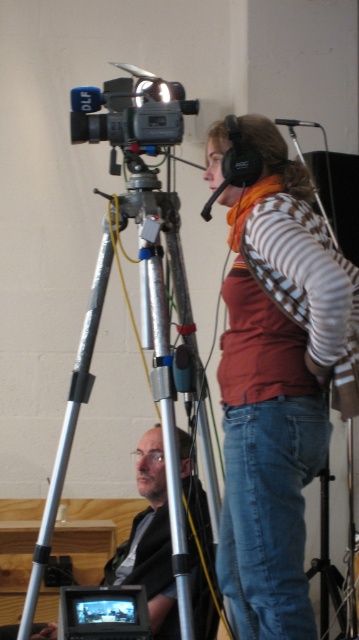
Between point (91, 376) and point (114, 81), which one is positioned in front?

Point (91, 376) is in front.

Which is behind, point (152, 205) or point (145, 145)?

The point (152, 205) is more distant.

Where is `silver metallic tripod at center`? silver metallic tripod at center is located at coordinates (169, 426).

Who is taller, striped cotton shirt at center or matte black camera at upper center?

With more height is striped cotton shirt at center.

Which is more to the left, striped cotton shirt at center or matte black camera at upper center?

Positioned to the left is matte black camera at upper center.

Between point (260, 177) and point (86, 102), which one is positioned behind?

The point (86, 102) is more distant.

Where is `striped cotton shirt at center`? Image resolution: width=359 pixels, height=640 pixels. striped cotton shirt at center is located at coordinates (277, 385).

Which is more to the right, silver metallic tripod at center or black plastic camera at center?

From the viewer's perspective, silver metallic tripod at center appears more on the right side.

Can you confirm if silver metallic tripod at center is thinner than black plastic camera at center?

In fact, silver metallic tripod at center might be wider than black plastic camera at center.

Who is more distant from viewer, (165, 237) or (70, 600)?

The point (165, 237) is behind.

This screenshot has width=359, height=640. What are the coordinates of `silver metallic tripod at center` in the screenshot? It's located at (169, 426).